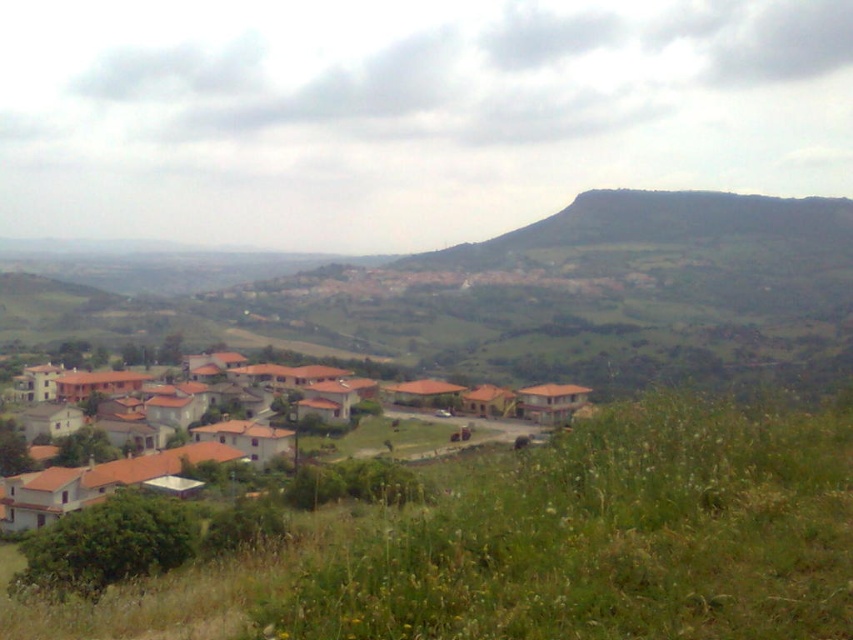
Between green grassy at lower center and brown clay houses at center, which one appears on the right side from the viewer's perspective?

From the viewer's perspective, green grassy at lower center appears more on the right side.

Which is in front, point (730, 554) or point (44, 515)?

Point (730, 554) is more forward.

Who is more distant from viewer, (722,595) or (221,435)?

The point (221,435) is more distant.

You are a GUI agent. You are given a task and a screenshot of the screen. Output one action in this format:
    pyautogui.click(x=<x>, y=<y>)
    Task: Click on the green grassy at lower center
    The image size is (853, 640).
    Given the screenshot: What is the action you would take?
    pyautogui.click(x=554, y=545)

Does point (685, 426) lie in front of point (851, 204)?

Yes, it is in front of point (851, 204).

Can you confirm if green grassy at lower center is taller than green grassy hill at upper center?

Incorrect, green grassy at lower center's height is not larger of green grassy hill at upper center's.

Is point (534, 547) behind point (432, 257)?

That is False.

At what (x,y) coordinates should I click in order to perform the action: click on green grassy at lower center. Please return your answer as a coordinate pair (x, y). The image size is (853, 640). Looking at the image, I should click on (554, 545).

Is green grassy hill at upper center above brown clay houses at center?

Yes.

Between point (849, 204) and point (227, 426), which one is positioned behind?

Positioned behind is point (849, 204).

The width and height of the screenshot is (853, 640). I want to click on green grassy hill at upper center, so click(x=654, y=225).